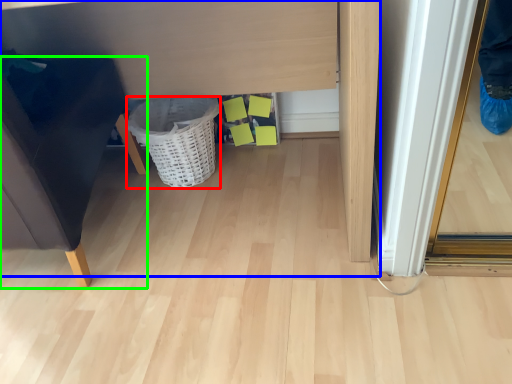
Question: Considering the real-world distances, which object is closest to basket (highlighted by a red box)? vanity (highlighted by a blue box) or furniture (highlighted by a green box).

Choices:
 (A) vanity
 (B) furniture

Answer: (A)